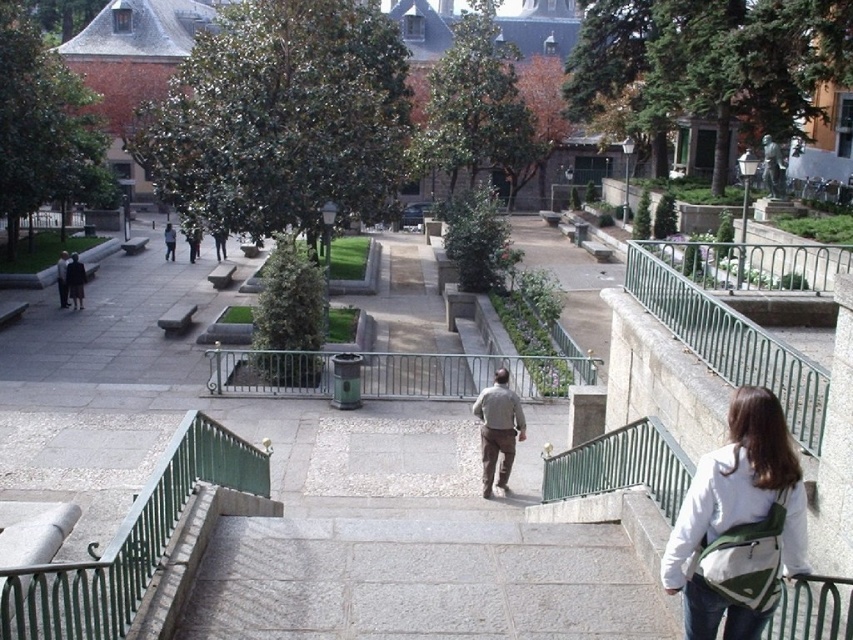
Which is more to the right, green metal railing at upper right or dark gray wool coat at left?

From the viewer's perspective, green metal railing at upper right appears more on the right side.

Can you confirm if green metal railing at upper right is wider than dark gray wool coat at left?

Yes, green metal railing at upper right is wider than dark gray wool coat at left.

Is point (773, 353) positioned behind point (76, 268)?

No.

Identify the location of green metal railing at upper right. The image size is (853, 640). coord(730,342).

Who is lower down, white fabric backpack at right or green metal railing at lower left?

green metal railing at lower left

Can you confirm if white fabric backpack at right is positioned to the left of green metal railing at lower left?

No, white fabric backpack at right is not to the left of green metal railing at lower left.

Image resolution: width=853 pixels, height=640 pixels. I want to click on white fabric backpack at right, so click(x=740, y=524).

Is the position of green metal railing at lower left more distant than that of green metal railing at upper right?

No, green metal railing at lower left is closer to the viewer.

Does green metal railing at lower left have a smaller size compared to green metal railing at upper right?

Yes.

I want to click on green metal railing at lower left, so pyautogui.click(x=129, y=541).

Locate an element on the screen. The image size is (853, 640). green metal railing at lower left is located at coordinates (129, 541).